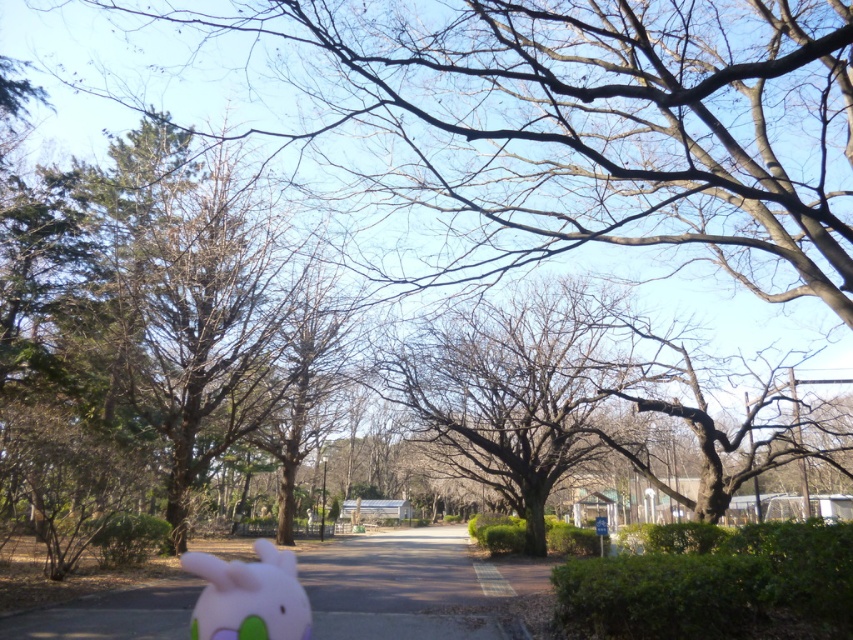
Question: Is bare branches at center smaller than pink felt plushie at lower left?

Choices:
 (A) no
 (B) yes

Answer: (B)

Question: Is bare branches at center further to camera compared to pink felt plushie at lower left?

Choices:
 (A) no
 (B) yes

Answer: (B)

Question: Among these points, which one is nearest to the camera?

Choices:
 (A) (283, 611)
 (B) (576, 460)

Answer: (A)

Question: Which point appears closest to the camera in this image?

Choices:
 (A) (215, 598)
 (B) (584, 305)

Answer: (A)

Question: Is bare branches at center smaller than pink felt plushie at lower left?

Choices:
 (A) yes
 (B) no

Answer: (A)